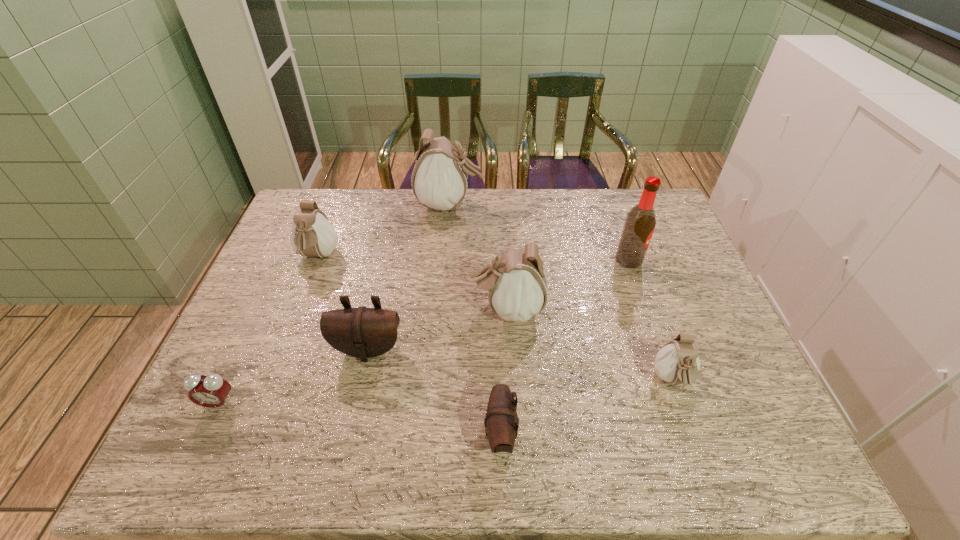
Where is `free space between the smallest white pouch and the farther brown pouch`? The image size is (960, 540). free space between the smallest white pouch and the farther brown pouch is located at coordinates (520, 365).

Where is `vacant region between the beer bottle and the sixth shortest object`? vacant region between the beer bottle and the sixth shortest object is located at coordinates (568, 285).

Identify the location of free area in between the beer bottle and the alarm clock. This screenshot has width=960, height=540. (423, 332).

Locate an element on the screen. Image resolution: width=960 pixels, height=540 pixels. empty space that is in between the bigger brown pouch and the fourth nearest pouch is located at coordinates (438, 329).

This screenshot has height=540, width=960. I want to click on unoccupied area between the third smallest white pouch and the farther brown pouch, so click(x=438, y=329).

Find the location of `free space between the nearest pouch and the alarm clock`. free space between the nearest pouch and the alarm clock is located at coordinates (359, 418).

Image resolution: width=960 pixels, height=540 pixels. In order to click on vacant area that lies between the beer bottle and the farthest object in this screenshot , I will do `click(540, 232)`.

This screenshot has height=540, width=960. I want to click on free space between the fourth nearest pouch and the rightmost pouch, so click(x=589, y=345).

Identify the location of object that is the sixth closest to the pink alarm clock. (677, 362).

Locate an element on the screen. The width and height of the screenshot is (960, 540). the fourth closest object relative to the leftmost white pouch is located at coordinates (516, 282).